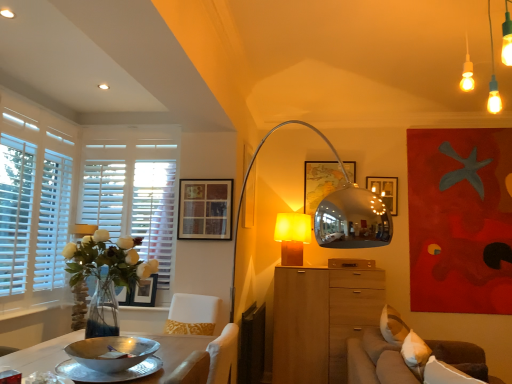
Question: Is matte black picture frame at upper center, which is the 2th picture frame in back-to-front order, at the left side of white wooden blinds at left?

Choices:
 (A) yes
 (B) no

Answer: (B)

Question: Is the position of matte black picture frame at upper center, which ranks as the third picture frame in top-to-bottom order, more distant than that of white wooden blinds at left?

Choices:
 (A) no
 (B) yes

Answer: (B)

Question: Is matte black picture frame at upper center, which is the 2th picture frame in back-to-front order, at the right side of white wooden blinds at left?

Choices:
 (A) yes
 (B) no

Answer: (A)

Question: From the image's perspective, would you say matte black picture frame at upper center, which is the first picture frame from left to right, is shown under white wooden blinds at left?

Choices:
 (A) yes
 (B) no

Answer: (A)

Question: Can you confirm if matte black picture frame at upper center, marked as the 2th picture frame in a front-to-back arrangement, is wider than white wooden blinds at left?

Choices:
 (A) yes
 (B) no

Answer: (B)

Question: Does matte black picture frame at upper center, which ranks as the third picture frame in top-to-bottom order, have a lesser width compared to white wooden blinds at left?

Choices:
 (A) no
 (B) yes

Answer: (B)

Question: Are wooden picture frame at upper center, which is the 1th picture frame in front-to-back order, and matte white pendant lights at upper right located far from each other?

Choices:
 (A) yes
 (B) no

Answer: (A)

Question: Considering the relative positions of wooden picture frame at upper center, arranged as the third picture frame when viewed from the back, and matte white pendant lights at upper right in the image provided, is wooden picture frame at upper center, arranged as the third picture frame when viewed from the back, in front of matte white pendant lights at upper right?

Choices:
 (A) no
 (B) yes

Answer: (A)

Question: Considering the relative sizes of wooden picture frame at upper center, which is the 2th picture frame from left to right, and matte white pendant lights at upper right in the image provided, is wooden picture frame at upper center, which is the 2th picture frame from left to right, shorter than matte white pendant lights at upper right?

Choices:
 (A) no
 (B) yes

Answer: (B)

Question: Is wooden picture frame at upper center, which is the 1th picture frame in front-to-back order, thinner than matte white pendant lights at upper right?

Choices:
 (A) yes
 (B) no

Answer: (A)

Question: Is wooden picture frame at upper center, which is the second picture frame from right to left, aimed at matte white pendant lights at upper right?

Choices:
 (A) yes
 (B) no

Answer: (B)

Question: From the image's perspective, is wooden picture frame at upper center, which is the second picture frame from right to left, located beneath matte white pendant lights at upper right?

Choices:
 (A) yes
 (B) no

Answer: (A)

Question: Is silver metallic bowl at lower left in front of brown fabric couch at lower right?

Choices:
 (A) yes
 (B) no

Answer: (B)